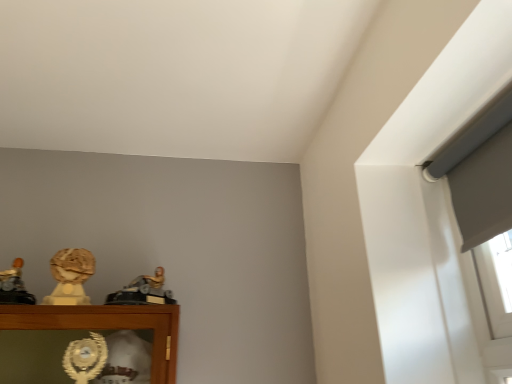
Question: Is point (28, 301) closer or farther from the camera than point (53, 294)?

Choices:
 (A) farther
 (B) closer

Answer: (A)

Question: Is matte gold statue at left, the 1th character sculpture viewed from the left, taller or shorter than matte gold bust at left, which appears as the 2th character sculpture when viewed from the left?

Choices:
 (A) short
 (B) tall

Answer: (A)

Question: Estimate the real-world distances between objects in this image. Which object is closer to the matte gold statue at left, the 3th character sculpture from the right?

Choices:
 (A) gold metallic figure at center, arranged as the 3th character sculpture when viewed from the left
 (B) matte gold bust at left, which appears as the 2th character sculpture when viewed from the left

Answer: (B)

Question: Which is farther from the matte gold statue at left, the 3th character sculpture from the right?

Choices:
 (A) matte gold bust at left, the second character sculpture positioned from the right
 (B) gold metallic figure at center, arranged as the 3th character sculpture when viewed from the left

Answer: (B)